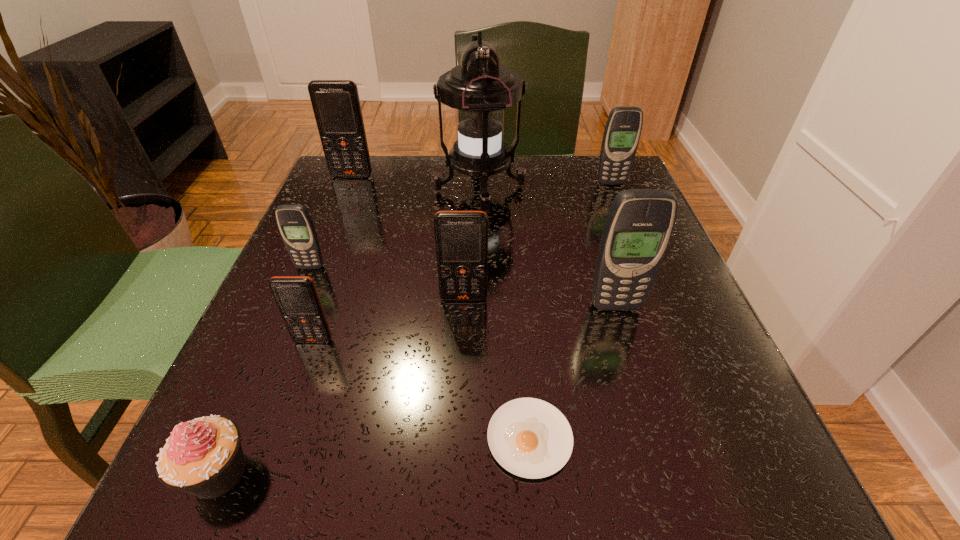
Identify the location of vacant space that is in between the tallest object and the eighth tallest object. Image resolution: width=960 pixels, height=540 pixels. (349, 330).

This screenshot has width=960, height=540. I want to click on free space between the nearest orange cellular telephone and the third cellular telephone from right to left, so click(x=389, y=319).

Identify the location of vacant space that's between the third cellular telephone from right to left and the farthest orange cellular telephone. The image size is (960, 540). (408, 237).

I want to click on free spot between the egg yolk and the nearest gray cellular telephone, so click(572, 372).

Locate an element on the screen. free space between the black lantern and the second shortest object is located at coordinates (349, 330).

Identify the location of vacant point located between the cupcake and the nearest gray cellular telephone. (418, 389).

Find the location of a particular element. The image size is (960, 540). free space between the eighth tallest object and the tallest object is located at coordinates (349, 330).

I want to click on vacant space in between the shortest object and the smallest orange cellular telephone, so click(421, 389).

Locate which object is the fifth closest to the farthest cellular telephone. Please provide its 2D coordinates. Your answer should be formatted as a tuple, i.e. [(x, y)], where the tuple contains the x and y coordinates of a point satisfying the conditions above.

[(623, 128)]

Identify which object is the third nearest to the third cellular telephone from right to left. Please provide its 2D coordinates. Your answer should be formatted as a tuple, i.e. [(x, y)], where the tuple contains the x and y coordinates of a point satisfying the conditions above.

[(530, 438)]